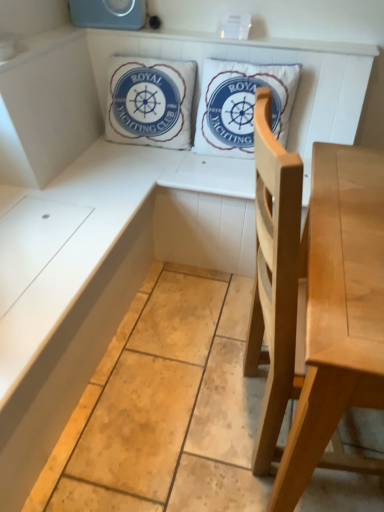
What are the coordinates of `vacant point to the left of light wood chair at center` in the screenshot? It's located at (163, 410).